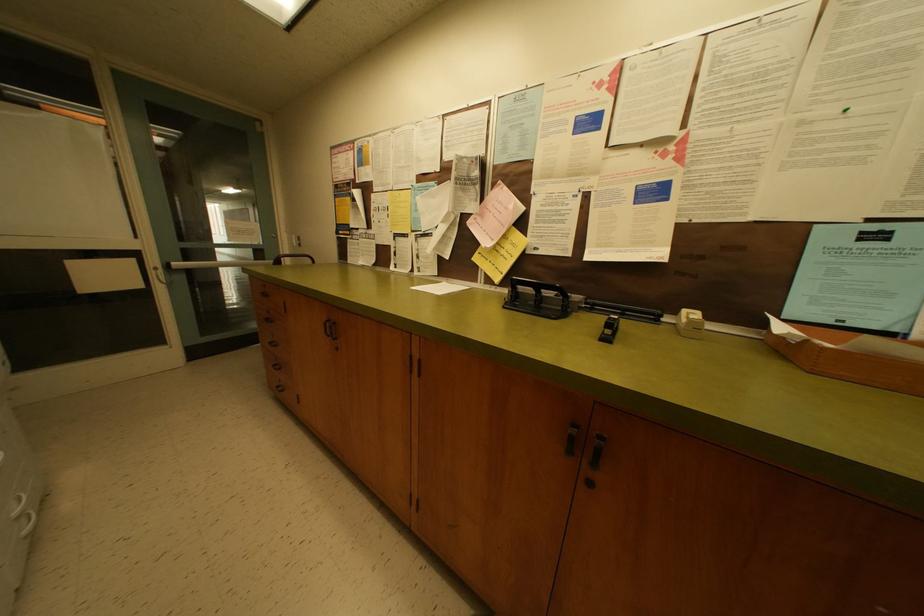
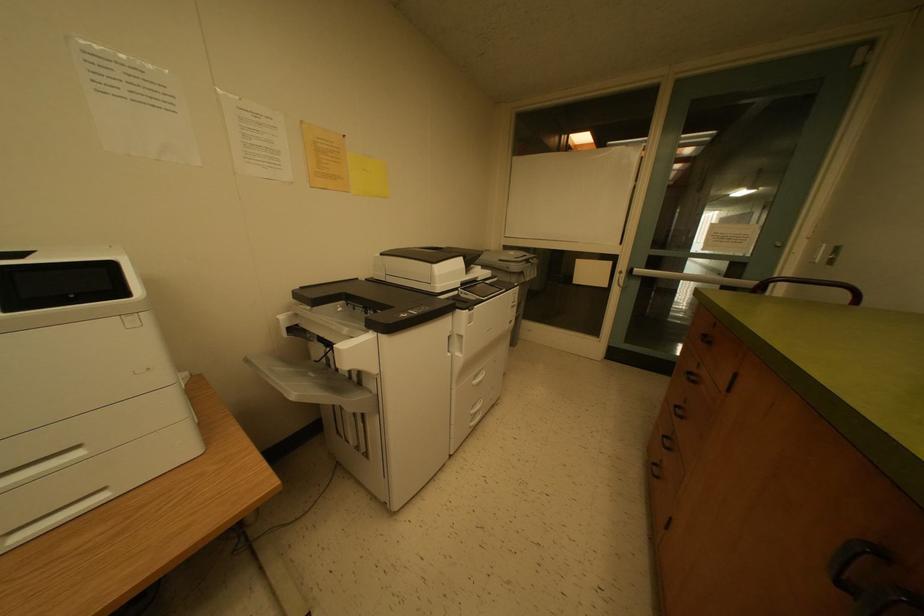
Question: Based on the continuous images, in which direction is the camera rotating? Reply with the corresponding letter.

Choices:
 (A) Left
 (B) Right
 (C) Up
 (D) Down

Answer: (A)